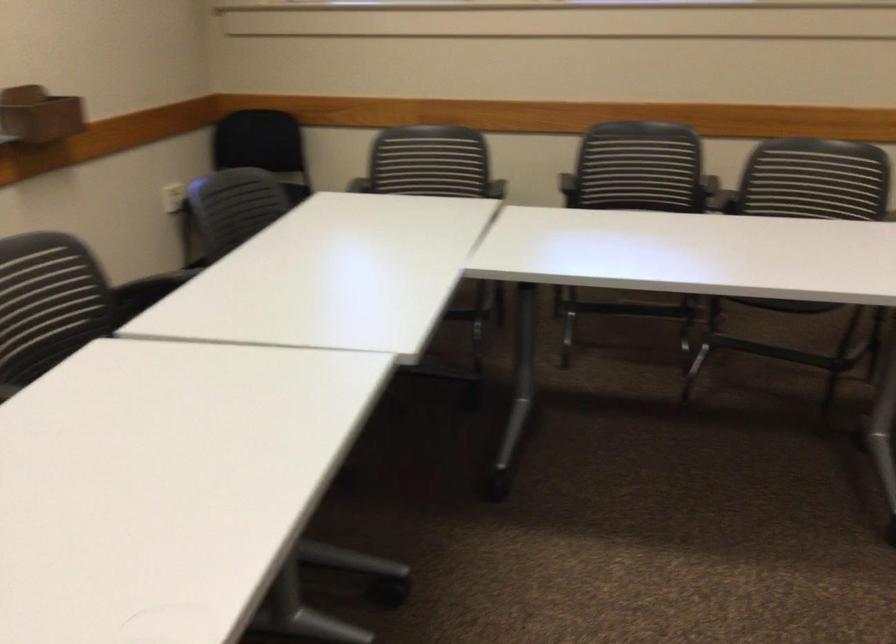
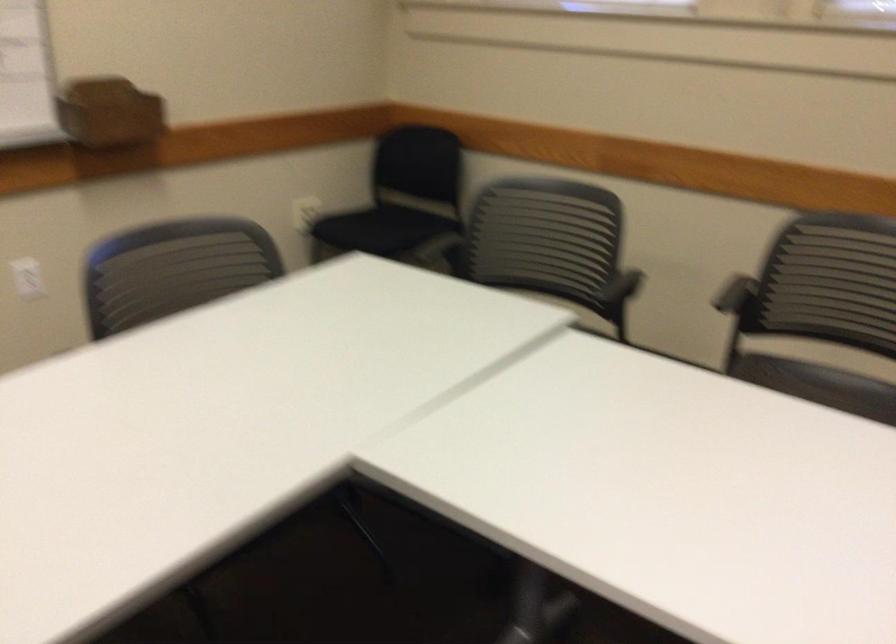
In a continuous first-person perspective shot, in which direction is the camera moving?

The cameraman moved toward right, forward.